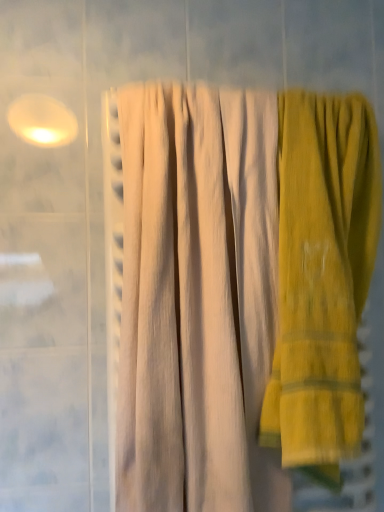
Question: Based on their sizes in the image, would you say yellow corduroy towel at right is bigger or smaller than beige textured towel at center?

Choices:
 (A) big
 (B) small

Answer: (B)

Question: Looking at their shapes, would you say yellow corduroy towel at right is wider or thinner than beige textured towel at center?

Choices:
 (A) thin
 (B) wide

Answer: (A)

Question: Based on their positions, is yellow corduroy towel at right located to the left or right of beige textured towel at center?

Choices:
 (A) left
 (B) right

Answer: (B)

Question: Is point (243, 458) positioned closer to the camera than point (367, 124)?

Choices:
 (A) closer
 (B) farther

Answer: (A)

Question: In terms of height, does beige textured towel at center look taller or shorter compared to yellow corduroy towel at right?

Choices:
 (A) short
 (B) tall

Answer: (B)

Question: Choose the correct answer: Is beige textured towel at center inside yellow corduroy towel at right or outside it?

Choices:
 (A) outside
 (B) inside

Answer: (A)

Question: In terms of size, does beige textured towel at center appear bigger or smaller than yellow corduroy towel at right?

Choices:
 (A) small
 (B) big

Answer: (B)